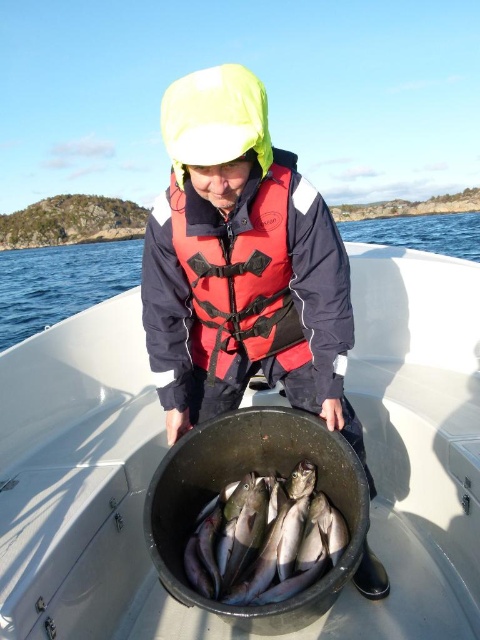
Question: Which object appears closest to the camera in this image?

Choices:
 (A) red matte life jacket at center
 (B) matte black jacket at center
 (C) shiny silver fish at center

Answer: (B)

Question: Does matte black jacket at center have a lesser width compared to red matte life jacket at center?

Choices:
 (A) no
 (B) yes

Answer: (A)

Question: Is matte black jacket at center thinner than clear blue water at center?

Choices:
 (A) no
 (B) yes

Answer: (B)

Question: Which object appears farthest from the camera in this image?

Choices:
 (A) clear blue water at center
 (B) red matte life jacket at center

Answer: (A)

Question: Does shiny silver fish at center lie behind clear blue water at center?

Choices:
 (A) yes
 (B) no

Answer: (B)

Question: Which object is positioned farthest from the clear blue water at center?

Choices:
 (A) shiny silver fish at center
 (B) matte black jacket at center

Answer: (B)